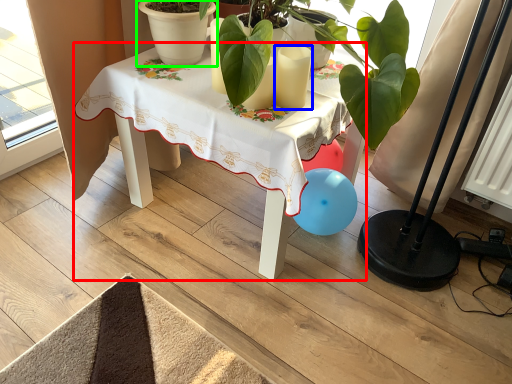
Question: Which is nearer to the table (highlighted by a red box)? candle (highlighted by a blue box) or flowerpot (highlighted by a green box).

Choices:
 (A) candle
 (B) flowerpot

Answer: (B)